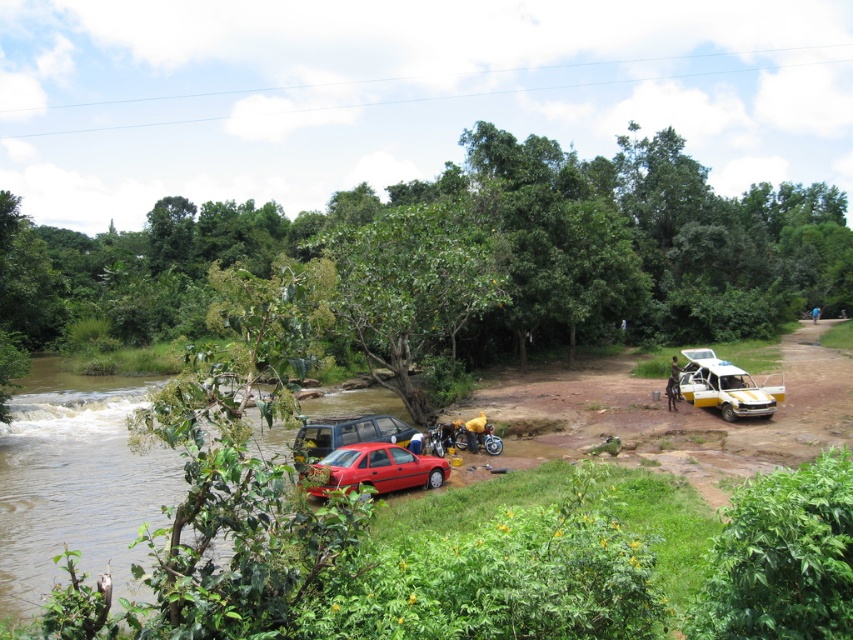
Question: Which object is positioned farthest from the yellow matte car at right?

Choices:
 (A) metallic blue jeep at lower left
 (B) shiny red car at lower center

Answer: (B)

Question: Which object appears farthest from the camera in this image?

Choices:
 (A) shiny red car at lower center
 (B) yellow matte car at right
 (C) metallic blue jeep at lower left

Answer: (B)

Question: Which of these objects is positioned closest to the smooth brown water at lower left?

Choices:
 (A) metallic blue jeep at lower left
 (B) shiny red car at lower center

Answer: (A)

Question: Can you confirm if shiny red car at lower center is smaller than metallic blue jeep at lower left?

Choices:
 (A) yes
 (B) no

Answer: (A)

Question: Can you confirm if shiny red car at lower center is positioned to the right of metallic blue jeep at lower left?

Choices:
 (A) no
 (B) yes

Answer: (B)

Question: Can you confirm if shiny red car at lower center is positioned to the right of metallic blue jeep at lower left?

Choices:
 (A) no
 (B) yes

Answer: (B)